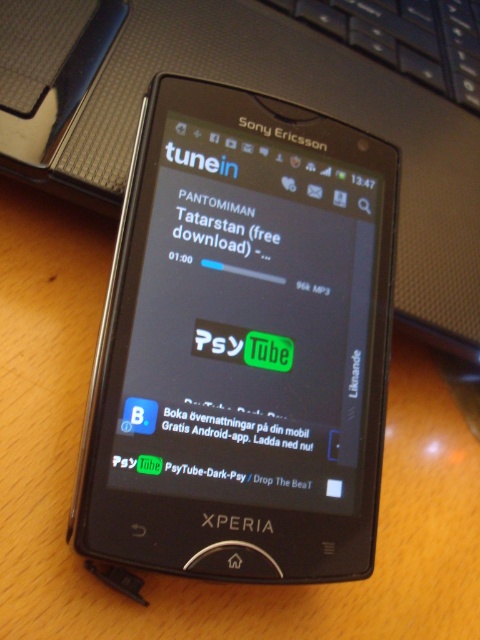
You are looking at the Sony Ericsson Xperia smartphone. Which object is on the right side between the matte black screen at center and the white matte text at center?

The matte black screen at center is positioned to the right of the white matte text at center.

You are looking at the Sony Ericsson Xperia smartphone on the wooden desk. There are two points marked on the phone screen. Which point, point (x=215, y=456) or point (x=216, y=220), is closer to you?

Point (x=215, y=456) is closer to the viewer than point (x=216, y=220).